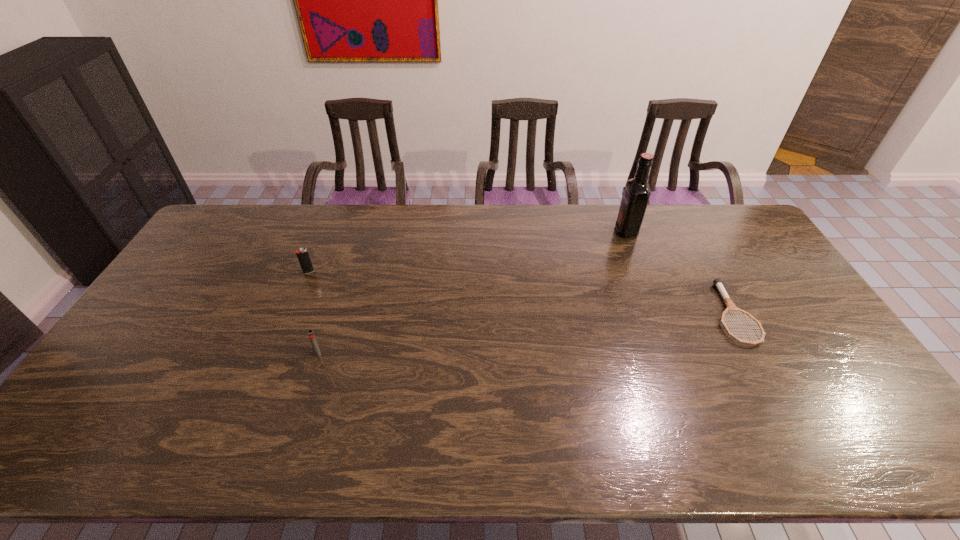
At what (x,y) coordinates should I click in order to perform the action: click on free space at the near left corner of the desktop. Please return your answer as a coordinate pair (x, y). The height and width of the screenshot is (540, 960). Looking at the image, I should click on (92, 441).

In the image, there is a desktop. Identify the location of vacant space at the far right corner. The height and width of the screenshot is (540, 960). 736,231.

Where is `vacant area that lies between the left igniter and the tennis racket`? The image size is (960, 540). vacant area that lies between the left igniter and the tennis racket is located at coordinates (520, 293).

At what (x,y) coordinates should I click in order to perform the action: click on vacant space that's between the second nearest object and the liquor. Please return your answer as a coordinate pair (x, y). This screenshot has width=960, height=540. Looking at the image, I should click on (679, 272).

Locate an element on the screen. This screenshot has height=540, width=960. vacant point located between the right igniter and the shortest object is located at coordinates (525, 333).

This screenshot has width=960, height=540. Identify the location of free space between the second object from right to left and the shortest object. (679, 272).

Locate an element on the screen. Image resolution: width=960 pixels, height=540 pixels. vacant space in between the third farthest object and the liquor is located at coordinates (679, 272).

Locate an element on the screen. This screenshot has width=960, height=540. vacant region between the liquor and the nearest object is located at coordinates (472, 292).

Locate an element on the screen. free space between the liquor and the shortest object is located at coordinates (679, 272).

Locate an element on the screen. unoccupied position between the second nearest object and the right igniter is located at coordinates (525, 333).